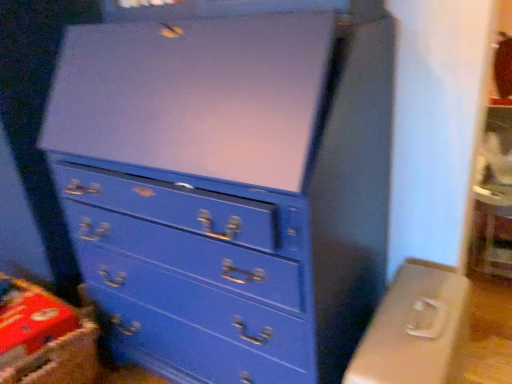
Question: From the image's perspective, is matte blue dresser at center beneath red cardboard crate at lower left?

Choices:
 (A) yes
 (B) no

Answer: (B)

Question: From the image's perspective, is matte blue dresser at center on red cardboard crate at lower left?

Choices:
 (A) yes
 (B) no

Answer: (A)

Question: Considering the relative sizes of matte blue dresser at center and red cardboard crate at lower left in the image provided, is matte blue dresser at center thinner than red cardboard crate at lower left?

Choices:
 (A) no
 (B) yes

Answer: (A)

Question: From a real-world perspective, is matte blue dresser at center under red cardboard crate at lower left?

Choices:
 (A) no
 (B) yes

Answer: (A)

Question: Considering the relative sizes of matte blue dresser at center and red cardboard crate at lower left in the image provided, is matte blue dresser at center taller than red cardboard crate at lower left?

Choices:
 (A) yes
 (B) no

Answer: (A)

Question: Is matte blue dresser at center aimed at red cardboard crate at lower left?

Choices:
 (A) no
 (B) yes

Answer: (A)

Question: Is red cardboard crate at lower left in contact with matte plastic computer desk at lower right?

Choices:
 (A) no
 (B) yes

Answer: (A)

Question: Is red cardboard crate at lower left smaller than matte plastic computer desk at lower right?

Choices:
 (A) no
 (B) yes

Answer: (B)

Question: Is red cardboard crate at lower left looking in the opposite direction of matte plastic computer desk at lower right?

Choices:
 (A) yes
 (B) no

Answer: (B)

Question: Does red cardboard crate at lower left have a lesser height compared to matte plastic computer desk at lower right?

Choices:
 (A) yes
 (B) no

Answer: (A)

Question: Is red cardboard crate at lower left closer to the viewer compared to matte plastic computer desk at lower right?

Choices:
 (A) no
 (B) yes

Answer: (A)

Question: Is red cardboard crate at lower left bigger than matte plastic computer desk at lower right?

Choices:
 (A) yes
 (B) no

Answer: (B)

Question: Is matte plastic computer desk at lower right turned away from matte blue dresser at center?

Choices:
 (A) yes
 (B) no

Answer: (B)